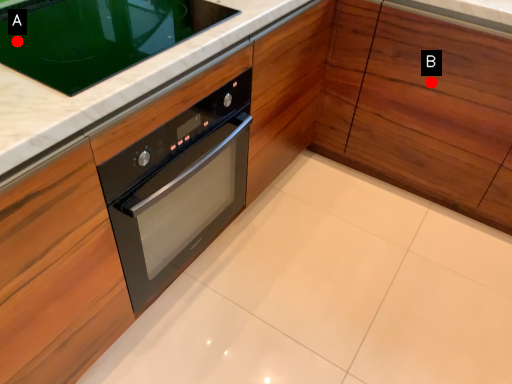
Question: Two points are circled on the image, labeled by A and B beside each circle. Which point appears farthest from the camera in this image?

Choices:
 (A) A is further
 (B) B is further

Answer: (B)